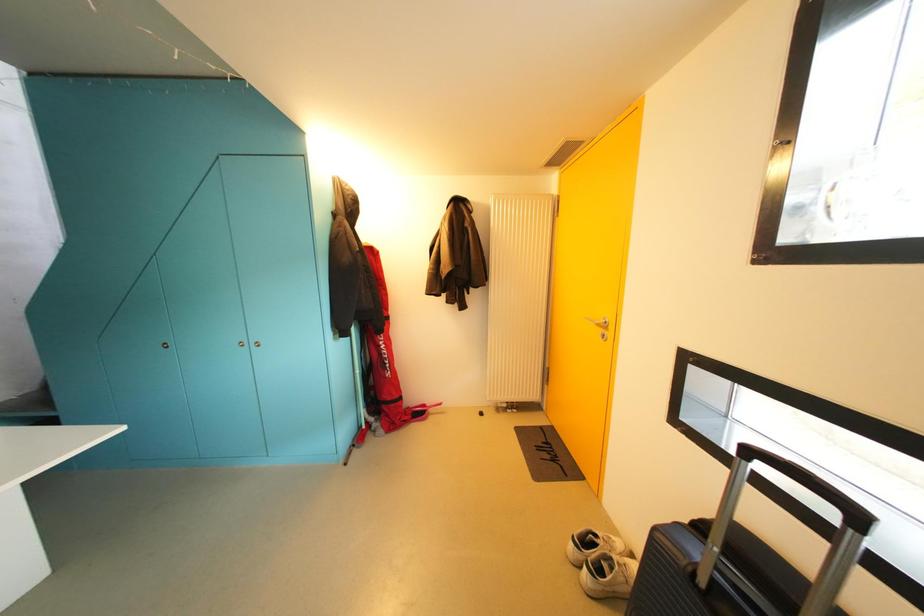
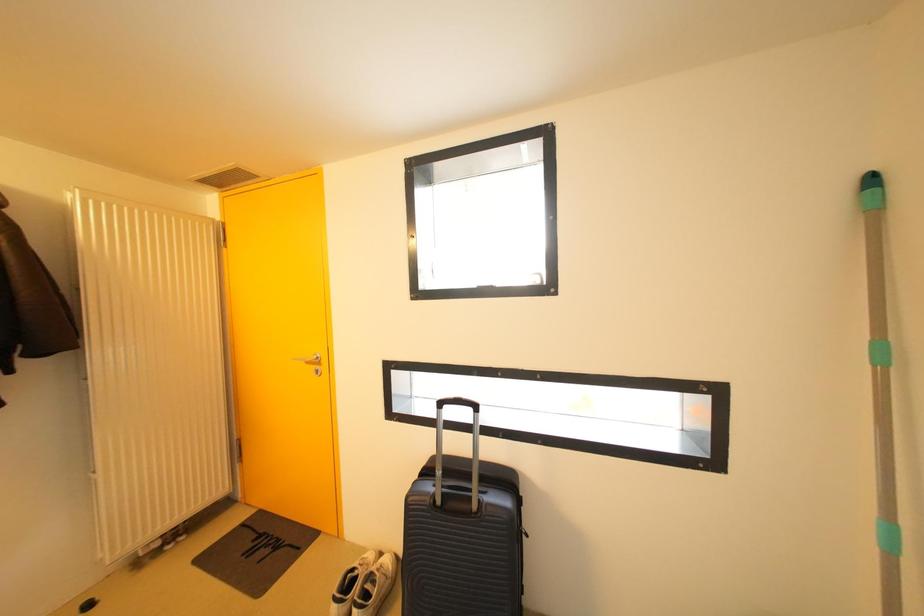
Question: Based on the continuous images, in which direction is the camera rotating? Reply with the corresponding letter.

Choices:
 (A) Left
 (B) Right
 (C) Up
 (D) Down

Answer: (B)